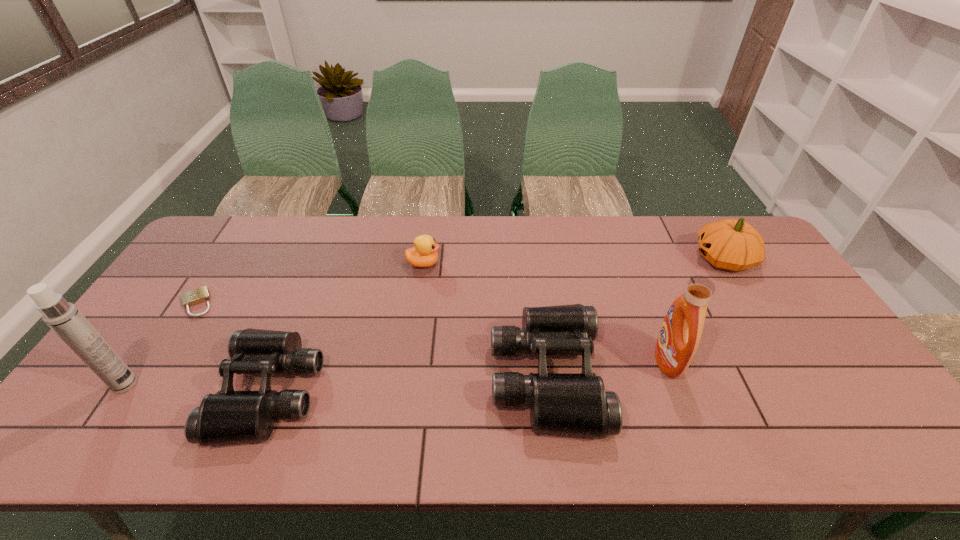
Where is `free space for a new binoculars on the right`? The image size is (960, 540). free space for a new binoculars on the right is located at coordinates (806, 361).